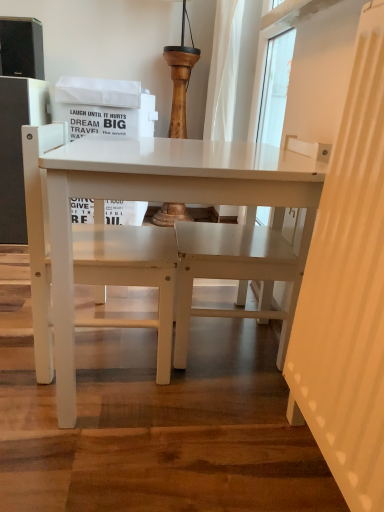
Measure the distance between white matte table at center and camera.

A distance of 63.99 centimeters exists between white matte table at center and camera.

Describe the element at coordinates (173, 232) in the screenshot. I see `white matte table at center` at that location.

I want to click on white matte table at center, so click(x=173, y=232).

This screenshot has height=512, width=384. Find the location of `white matte chair at center`. white matte chair at center is located at coordinates (130, 275).

This screenshot has width=384, height=512. Describe the element at coordinates (130, 275) in the screenshot. I see `white matte chair at center` at that location.

The image size is (384, 512). I want to click on white matte table at center, so click(x=173, y=232).

Considering the relative positions of white matte table at center and white matte chair at center in the image provided, is white matte table at center to the right of white matte chair at center from the viewer's perspective?

Indeed, white matte table at center is positioned on the right side of white matte chair at center.

Is white matte table at center in front of white matte chair at center?

Yes, white matte table at center is closer to the viewer.

Does point (276, 220) come in front of point (28, 145)?

No, it is not.

From the image's perspective, which is below, white matte table at center or white matte chair at center?

From the image's view, white matte table at center is below.

Based on the photo, from a real-world perspective, is white matte table at center located beneath white matte chair at center?

Yes, from a real-world perspective, white matte table at center is beneath white matte chair at center.

Considering the relative sizes of white matte table at center and white matte chair at center in the image provided, is white matte table at center wider than white matte chair at center?

Indeed, white matte table at center has a greater width compared to white matte chair at center.

Between white matte table at center and white matte chair at center, which one has more height?

Standing taller between the two is white matte table at center.

Which of these two, white matte table at center or white matte chair at center, is bigger?

Bigger between the two is white matte table at center.

Could white matte chair at center be considered to be inside white matte table at center?

Yes, white matte chair at center is a part of white matte table at center.

Is white matte table at center not close to white matte chair at center?

No, white matte table at center is in close proximity to white matte chair at center.

Is white matte table at center looking in the opposite direction of white matte chair at center?

Yes, white matte table at center's orientation is away from white matte chair at center.

Locate an element on the screen. The width and height of the screenshot is (384, 512). chair above the white matte table at center (from the image's perspective) is located at coordinates (130, 275).

Based on their positions, is white matte chair at center located to the left or right of white matte table at center?

white matte chair at center is positioned on white matte table at center's left side.

Which is behind, white matte chair at center or white matte table at center?

Positioned behind is white matte chair at center.

Does point (126, 228) appear closer or farther from the camera than point (186, 199)?

Clearly, point (126, 228) is more distant from the camera than point (186, 199).

From the image's perspective, is white matte chair at center on white matte table at center?

Yes.

From a real-world perspective, between white matte chair at center and white matte table at center, who is vertically higher?

white matte chair at center is physically above.

Which object is wider, white matte chair at center or white matte table at center?

Wider between the two is white matte table at center.

Considering the sizes of objects white matte chair at center and white matte table at center in the image provided, who is shorter, white matte chair at center or white matte table at center?

white matte chair at center.

Does white matte chair at center have a smaller size compared to white matte table at center?

Correct, white matte chair at center occupies less space than white matte table at center.

Is white matte chair at center positioned beyond the bounds of white matte table at center?

No, most part of white matte chair at center lies within white matte table at center.

Is there a large distance between white matte chair at center and white matte table at center?

white matte chair at center is actually quite close to white matte table at center.

Is white matte chair at center turned away from white matte table at center?

Absolutely, white matte chair at center is directed away from white matte table at center.

How far apart are white matte chair at center and white matte table at center?

The distance of white matte chair at center from white matte table at center is 9.46 centimeters.

Where is `chair lying above the white matte table at center (from the image's perspective)`? The width and height of the screenshot is (384, 512). chair lying above the white matte table at center (from the image's perspective) is located at coordinates (130, 275).

Locate an element on the screen. The height and width of the screenshot is (512, 384). chair located above the white matte table at center (from a real-world perspective) is located at coordinates (130, 275).

Image resolution: width=384 pixels, height=512 pixels. Find the location of `chair on the left of white matte table at center`. chair on the left of white matte table at center is located at coordinates (130, 275).